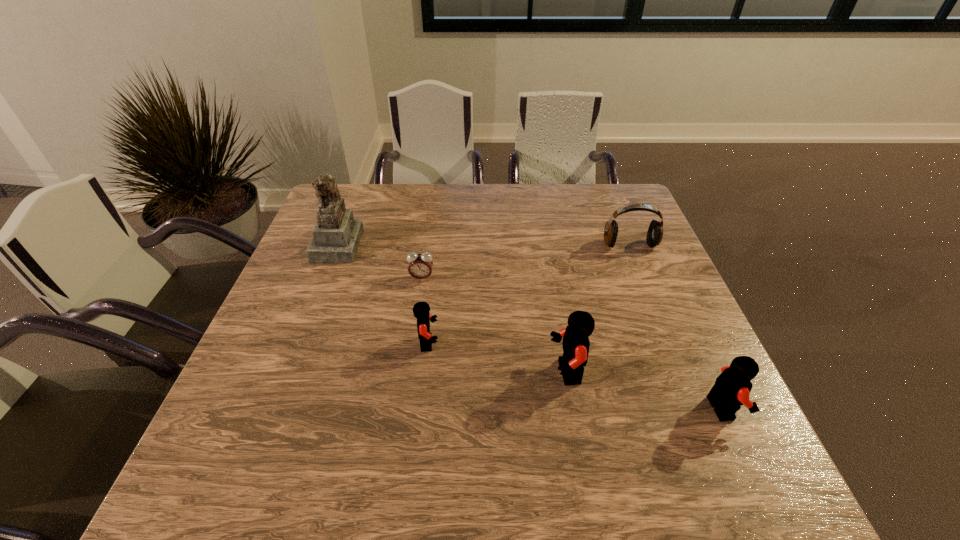
Locate an element on the screen. This screenshot has width=960, height=540. vacant area between the leftmost object and the fourth object from left to right is located at coordinates (x=452, y=308).

Identify the location of free area in between the leftmost Lego and the headset. The image size is (960, 540). (529, 294).

The width and height of the screenshot is (960, 540). What are the coordinates of `vacant area between the headset and the leftmost object` in the screenshot? It's located at (484, 245).

This screenshot has width=960, height=540. I want to click on vacant area that lies between the alarm clock and the headset, so click(526, 261).

Locate an element on the screen. Image resolution: width=960 pixels, height=540 pixels. object that is the closest to the fourth nearest object is located at coordinates (336, 236).

Choose which object is the fourth nearest neighbor to the second Lego from left to right. Please provide its 2D coordinates. Your answer should be formatted as a tuple, i.e. [(x, y)], where the tuple contains the x and y coordinates of a point satisfying the conditions above.

[(654, 236)]

In order to click on Lego that can be found as the second closest to the second Lego from right to left in this screenshot , I will do `click(421, 310)`.

Locate an element on the screen. the closest Lego to the rightmost Lego is located at coordinates (581, 324).

Where is `free region that satisfies the following two spatial constraints: 1. on the ear cups of the headset; 2. on the front-facing side of the leftmost Lego`? This screenshot has width=960, height=540. free region that satisfies the following two spatial constraints: 1. on the ear cups of the headset; 2. on the front-facing side of the leftmost Lego is located at coordinates (670, 343).